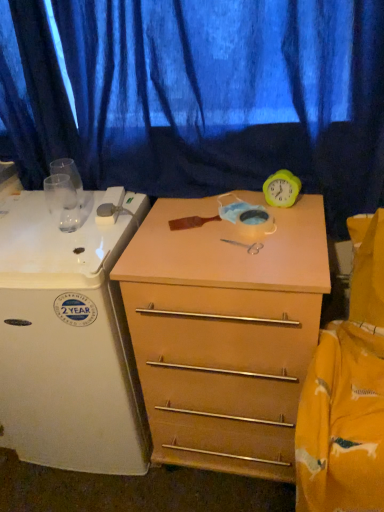
Question: Is white glossy refrigerator at left to the left or to the right of light wood/finish chest of drawers at center in the image?

Choices:
 (A) left
 (B) right

Answer: (A)

Question: From a real-world perspective, is white glossy refrigerator at left physically located above or below light wood/finish chest of drawers at center?

Choices:
 (A) above
 (B) below

Answer: (A)

Question: Estimate the real-world distances between objects in this image. Which object is closer to the yellow rubber clock at upper right?

Choices:
 (A) blue fabric curtain at upper center
 (B) white glossy refrigerator at left
 (C) light wood/finish chest of drawers at center

Answer: (A)

Question: Based on their relative distances, which object is nearer to the blue fabric curtain at upper center?

Choices:
 (A) yellow rubber clock at upper right
 (B) white glossy refrigerator at left
 (C) light wood/finish chest of drawers at center

Answer: (A)